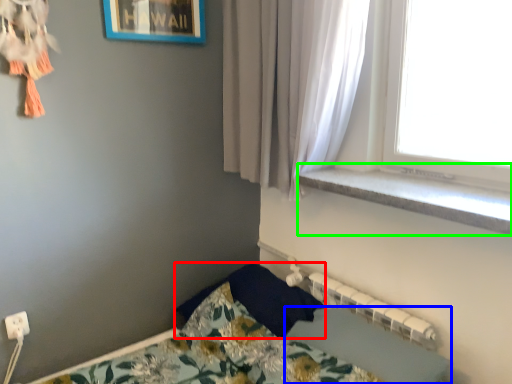
Question: Which is farther away from pillow (highlighted by a red box)? sheet (highlighted by a blue box) or window sill (highlighted by a green box)?

Choices:
 (A) sheet
 (B) window sill

Answer: (B)